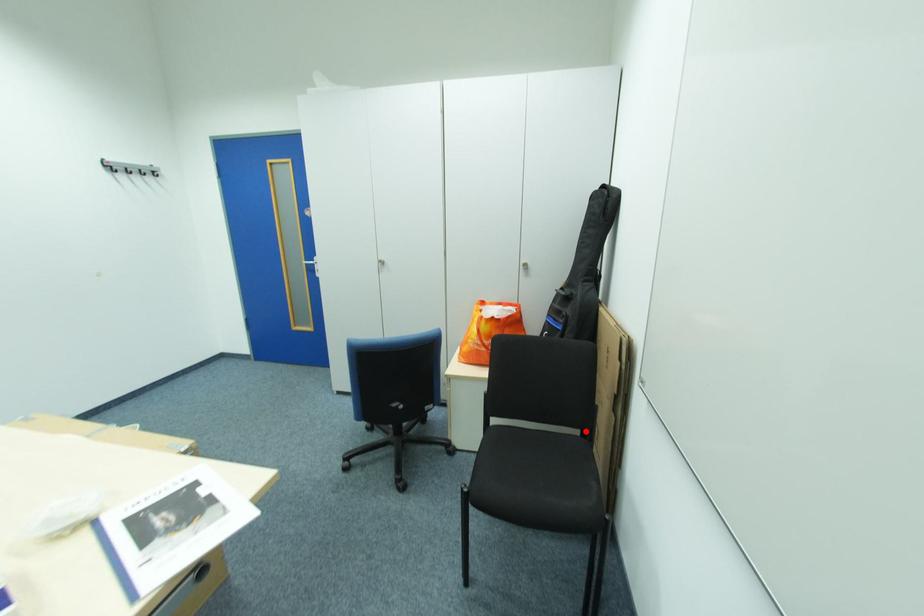
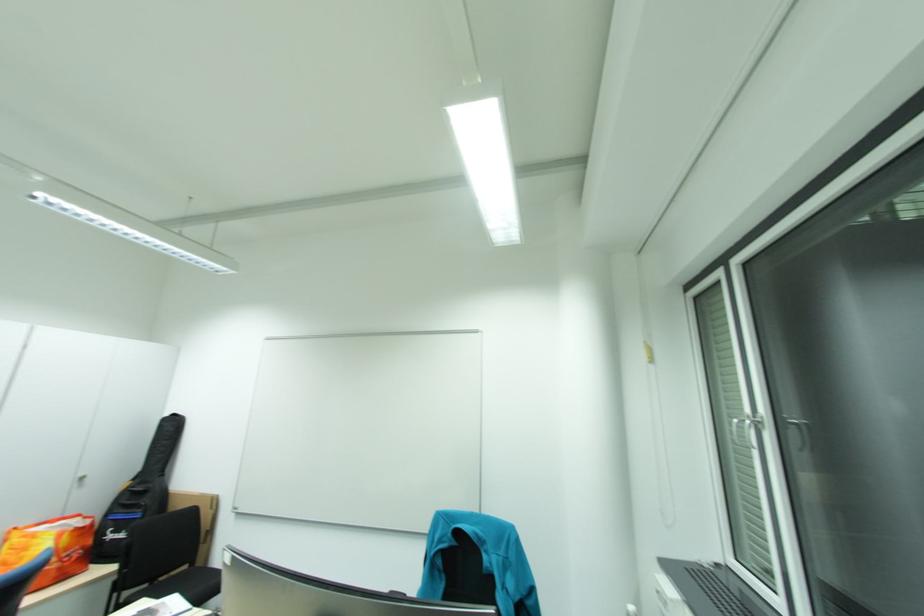
In the second image, find the point that corresponds to the highlighted location in the first image.

(193, 568)